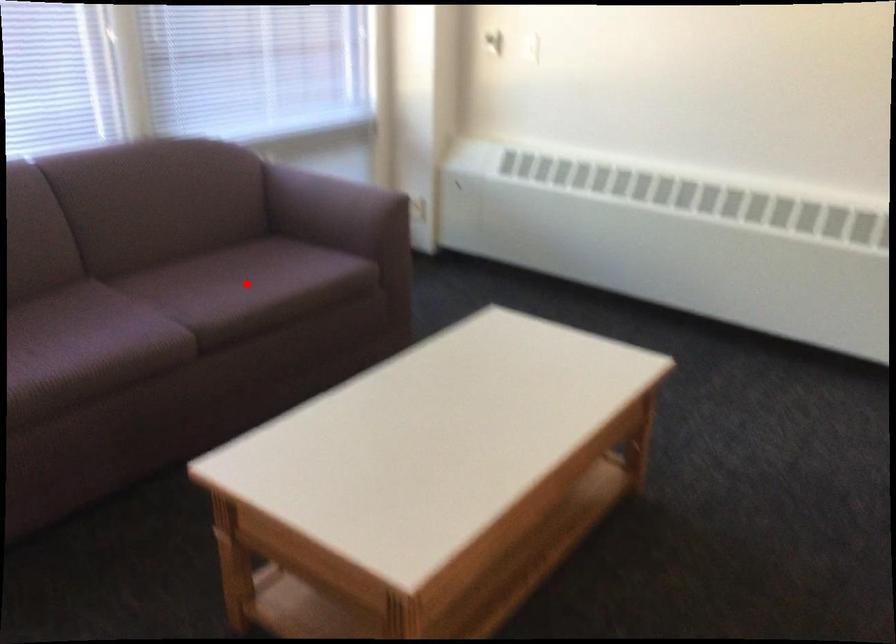
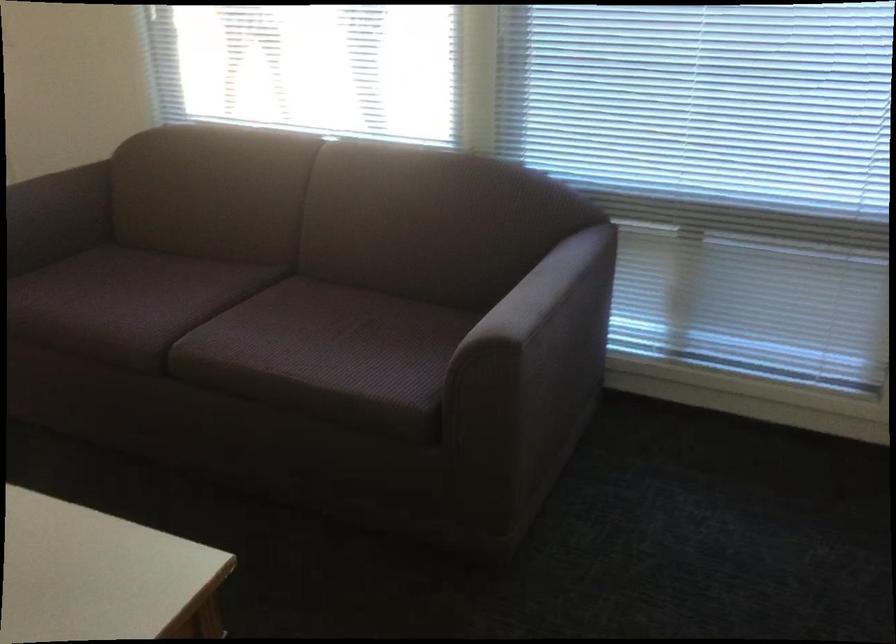
Question: I am providing you with two images of the same scene from different viewpoints. In image1, a red point is highlighted. Considering the same 3D point in image2, which of the following is correct?

Choices:
 (A) It is closer
 (B) It is farther

Answer: (A)